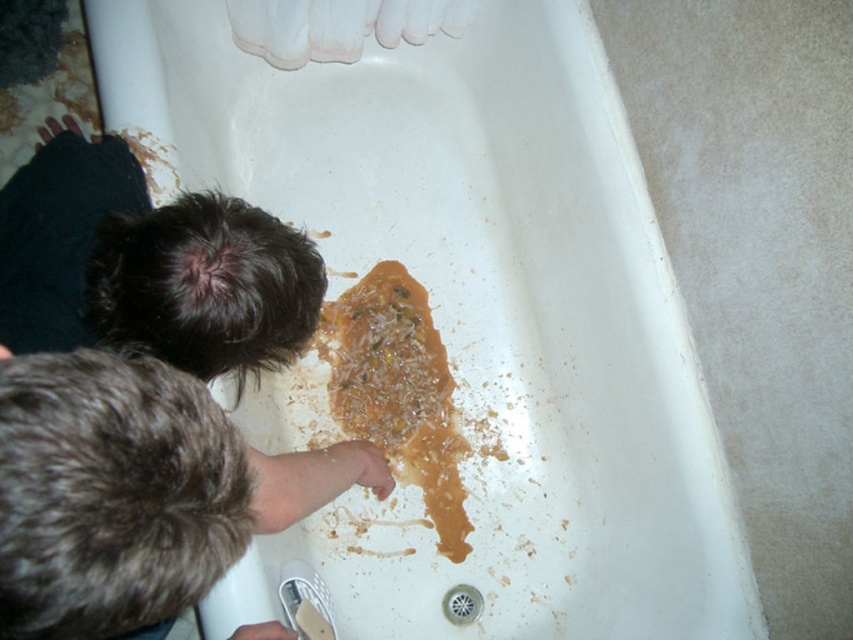
You are standing in a bathroom and need to reach both the point at coordinates (254, 276) and the point at (422, 496). Which point should you approach first to reach the closer one?

You should approach point (254, 276) first because it is closer to you than point (422, 496).

You are a cleaning robot with a height of 18 inches. You are in a bathroom and see the dark brown fur at upper left. Can you reach it without touching it?

The dark brown fur at upper left and viewer are 28.61 inches apart. Since the robot is 18 inches tall, it can reach the dark brown fur at upper left as the distance is greater than the robot height.

You are a plumber trying to unclog the drain in the bathtub. You see the dark brown fur at upper left and the brown crumbly food at center. Which object is closer to you as you look into the tub?

The dark brown fur at upper left is closer to you because it is in front of the brown crumbly food at center.